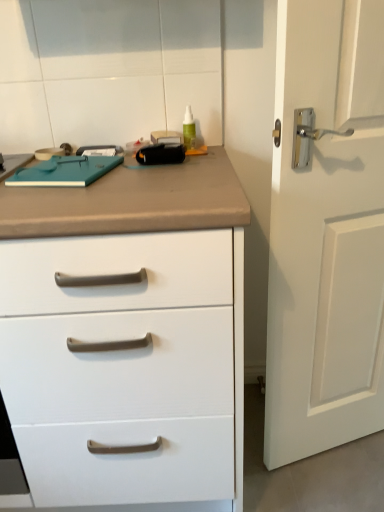
Question: Does point (215, 355) appear closer or farther from the camera than point (370, 99)?

Choices:
 (A) farther
 (B) closer

Answer: (B)

Question: From a real-world perspective, is white matte chest of drawers at center positioned above or below white matte door at right?

Choices:
 (A) below
 (B) above

Answer: (A)

Question: In terms of size, does white matte chest of drawers at center appear bigger or smaller than white matte door at right?

Choices:
 (A) small
 (B) big

Answer: (B)

Question: Is white matte door at right to the left or to the right of white matte chest of drawers at center in the image?

Choices:
 (A) right
 (B) left

Answer: (A)

Question: From a real-world perspective, relative to white matte chest of drawers at center, is white matte door at right vertically above or below?

Choices:
 (A) below
 (B) above

Answer: (B)

Question: Is white matte door at right inside or outside of white matte chest of drawers at center?

Choices:
 (A) outside
 (B) inside

Answer: (A)

Question: In the image, is white matte door at right positioned in front of or behind white matte chest of drawers at center?

Choices:
 (A) front
 (B) behind

Answer: (B)